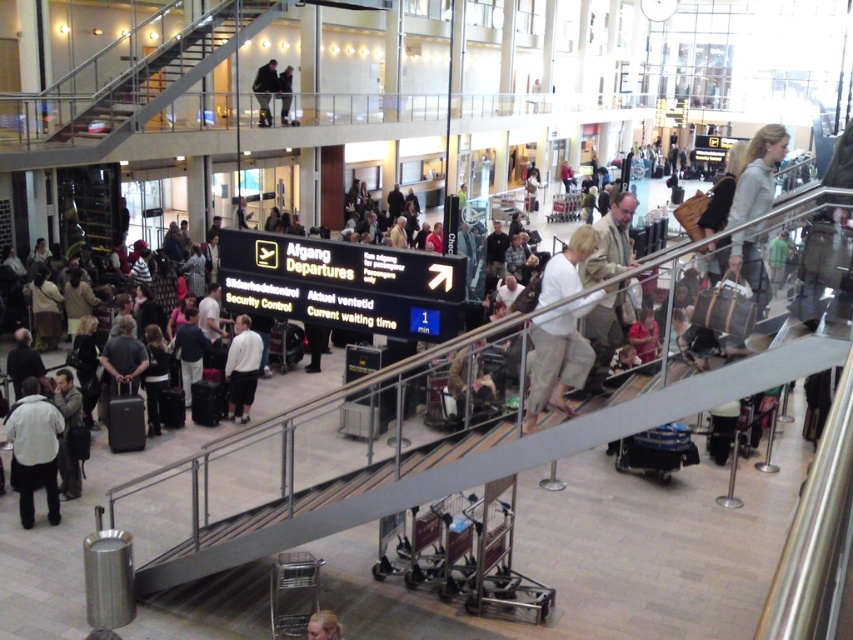
Question: Among these points, which one is farthest from the camera?

Choices:
 (A) (614, 202)
 (B) (326, 609)

Answer: (B)

Question: Can you confirm if light beige pants at center is thinner than matte black suitcase at lower left?

Choices:
 (A) no
 (B) yes

Answer: (A)

Question: Is metallic staircase at upper left positioned at the back of white matte shirt at center?

Choices:
 (A) yes
 (B) no

Answer: (A)

Question: Which point is closer to the camera?

Choices:
 (A) matte black suitcase at lower left
 (B) blonde hair at center

Answer: (B)

Question: Estimate the real-world distances between objects in this image. Which object is farther from the dark gray suit at upper center?

Choices:
 (A) dark blue jeans at upper center
 (B) matte black suitcase at lower left

Answer: (B)

Question: Does light beige pants at center have a lesser width compared to light gray sweater at upper right?

Choices:
 (A) yes
 (B) no

Answer: (A)